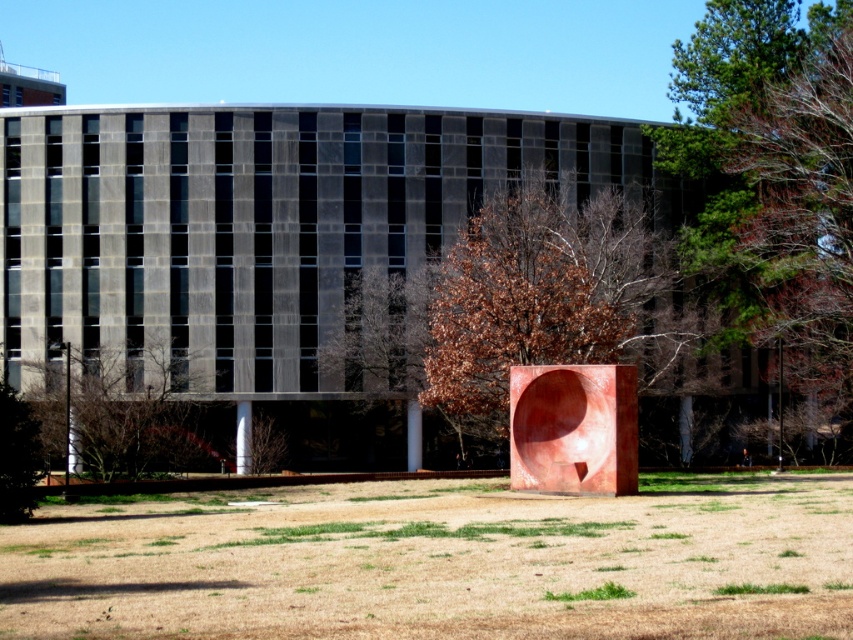
Question: Among these points, which one is nearest to the camera?

Choices:
 (A) (166, 397)
 (B) (544, 592)

Answer: (B)

Question: Is brown matte tree at center above green grass at lower center?

Choices:
 (A) yes
 (B) no

Answer: (A)

Question: Considering the real-world distances, which object is farthest from the brown dry grass at lower center?

Choices:
 (A) brown leafy tree at lower left
 (B) brown matte tree at center

Answer: (A)

Question: Considering the relative positions of brown dry grass at lower center and brown matte tree at center in the image provided, where is brown dry grass at lower center located with respect to brown matte tree at center?

Choices:
 (A) below
 (B) above

Answer: (A)

Question: Does brown dry grass at lower center have a larger size compared to brown leafy tree at lower left?

Choices:
 (A) no
 (B) yes

Answer: (B)

Question: Which object appears farthest from the camera in this image?

Choices:
 (A) green grass at lower center
 (B) brown dry grass at lower center
 (C) brown leafy tree at upper right
 (D) brown leafy tree at lower left

Answer: (C)